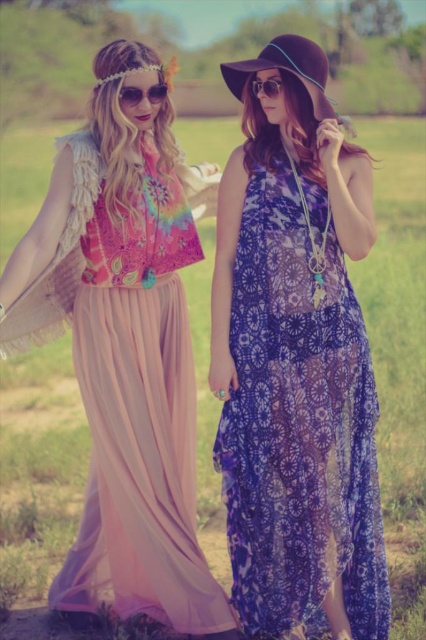
How much distance is there between matte pink chiffon skirt at left and velvet purple hat at upper center?

A distance of 1.22 meters exists between matte pink chiffon skirt at left and velvet purple hat at upper center.

Is point (149, 372) behind point (250, 60)?

No, (149, 372) is in front of (250, 60).

Which is in front, point (111, 336) or point (265, 51)?

Positioned in front is point (265, 51).

Find the location of `matte pink chiffon skirt at left`. matte pink chiffon skirt at left is located at coordinates (129, 353).

Which is behind, point (284, 538) or point (256, 83)?

Positioned behind is point (284, 538).

Who is more forward, (304, 484) or (276, 93)?

Positioned in front is point (276, 93).

Who is more forward, (350, 374) or (270, 93)?

Point (270, 93) is more forward.

Locate an element on the screen. Image resolution: width=426 pixels, height=640 pixels. purple sheer dress at right is located at coordinates (299, 420).

Is matte pink chiffon skirt at left above sunglasses at center?

Actually, matte pink chiffon skirt at left is below sunglasses at center.

Who is positioned more to the left, matte pink chiffon skirt at left or sunglasses at center?

matte pink chiffon skirt at left is more to the left.

Who is more distant from viewer, (115,209) or (276,88)?

The point (115,209) is behind.

This screenshot has height=640, width=426. I want to click on matte pink chiffon skirt at left, so [x=129, y=353].